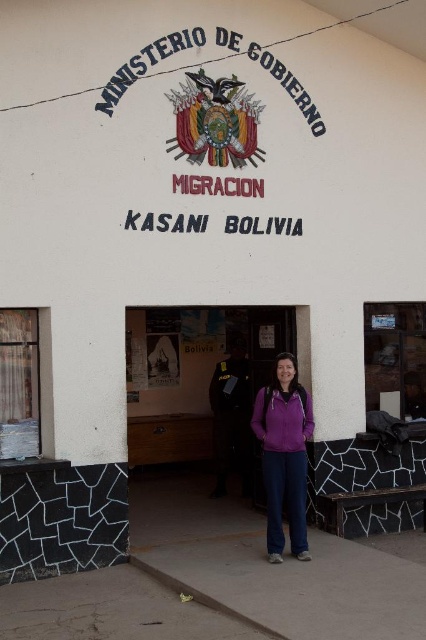
You are standing in front of the Ministry of Government Migration office in Kasani, Bolivia. You need to enter the building but notice a wooden door at center and a black leather jacket at center. Which object is positioned to the left from your perspective?

The wooden door at center is to the left of the black leather jacket at center.

You are a security guard at the Ministry of Government Migration office in Kasani. You notice two jackets hanging on a rack near the entrance. The purple fleece jacket at center and the black leather jacket at center. Which jacket is positioned higher on the rack?

The purple fleece jacket at center is located above the black leather jacket at center, so it is positioned higher on the rack.